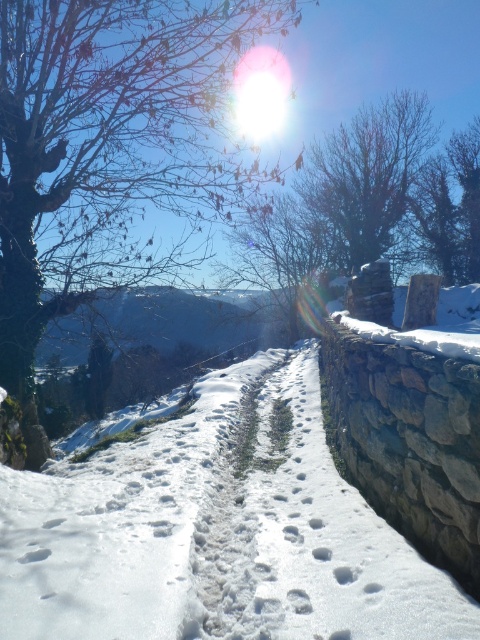
Which of these two, bare branches at upper left or bare branches at upper center, stands shorter?

Standing shorter between the two is bare branches at upper center.

Is bare branches at upper left thinner than bare branches at upper center?

Indeed, bare branches at upper left has a lesser width compared to bare branches at upper center.

The image size is (480, 640). What do you see at coordinates (110, 150) in the screenshot?
I see `bare branches at upper left` at bounding box center [110, 150].

Locate an element on the screen. bare branches at upper left is located at coordinates (110, 150).

Which is in front, point (294, 374) or point (356, 131)?

Point (294, 374)

Is point (93, 616) positioned in front of point (328, 224)?

Yes.

Locate an element on the screen. The width and height of the screenshot is (480, 640). white powdery snow at center is located at coordinates (215, 531).

From the picture: Who is higher up, white powdery snow at center or bare branches at upper left?

bare branches at upper left

Does white powdery snow at center have a lesser width compared to bare branches at upper left?

Yes, white powdery snow at center is thinner than bare branches at upper left.

At what (x,y) coordinates should I click in order to perform the action: click on white powdery snow at center. Please return your answer as a coordinate pair (x, y). The image size is (480, 640). Looking at the image, I should click on (215, 531).